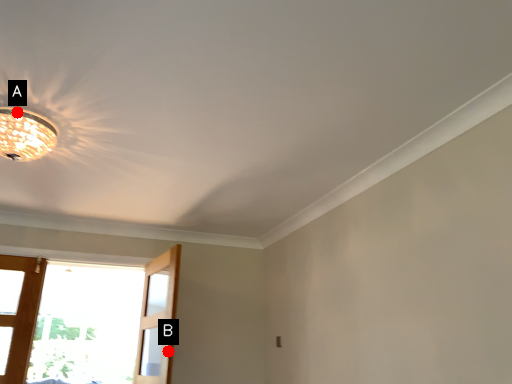
Question: Two points are circled on the image, labeled by A and B beside each circle. Which point is further to the camera?

Choices:
 (A) A is further
 (B) B is further

Answer: (B)